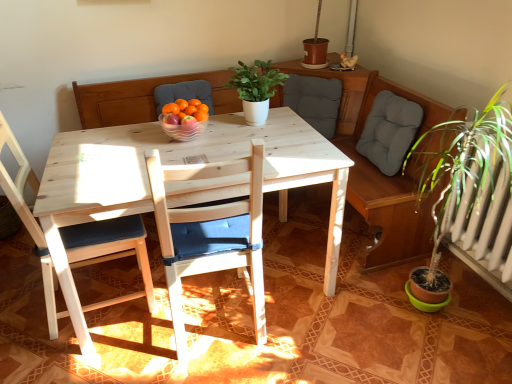
Question: Can you confirm if gray fabric cushion at upper center is wider than wooden chair with blue cushion at left, which is the 1th chair from left to right?

Choices:
 (A) no
 (B) yes

Answer: (A)

Question: Considering the relative sizes of gray fabric cushion at upper center and wooden chair with blue cushion at left, which is the 1th chair from left to right, in the image provided, is gray fabric cushion at upper center taller than wooden chair with blue cushion at left, which is the 1th chair from left to right,?

Choices:
 (A) yes
 (B) no

Answer: (B)

Question: Is wooden chair with blue cushion at left, which is counted as the 2th chair, starting from the right, at the back of gray fabric cushion at upper center?

Choices:
 (A) no
 (B) yes

Answer: (A)

Question: Is gray fabric cushion at upper center far away from wooden chair with blue cushion at left, which is the 1th chair from left to right?

Choices:
 (A) no
 (B) yes

Answer: (B)

Question: Could you tell me if gray fabric cushion at upper center is turned towards wooden chair with blue cushion at left, which is counted as the 2th chair, starting from the right?

Choices:
 (A) no
 (B) yes

Answer: (B)

Question: Is gray fabric cushion at upper center completely or partially outside of wooden chair with blue cushion at left, which is counted as the 2th chair, starting from the right?

Choices:
 (A) yes
 (B) no

Answer: (A)

Question: Can you confirm if wooden chair with blue cushion at center, which is the 1th chair from right to left, is smaller than green matte plant at center?

Choices:
 (A) yes
 (B) no

Answer: (B)

Question: Can you confirm if wooden chair with blue cushion at center, the second chair from the left, is bigger than green matte plant at center?

Choices:
 (A) yes
 (B) no

Answer: (A)

Question: Is wooden chair with blue cushion at center, the second chair from the left, positioned in front of green matte plant at center?

Choices:
 (A) yes
 (B) no

Answer: (A)

Question: Is green matte plant at center inside wooden chair with blue cushion at center, the second chair from the left?

Choices:
 (A) no
 (B) yes

Answer: (A)

Question: Is wooden chair with blue cushion at center, the second chair from the left, oriented away from green matte plant at center?

Choices:
 (A) no
 (B) yes

Answer: (A)

Question: Does wooden chair with blue cushion at center, which is the 1th chair from right to left, have a greater height compared to green matte plant at center?

Choices:
 (A) no
 (B) yes

Answer: (B)

Question: Does clear glass bowl at center contain wooden chair with blue cushion at left, which is counted as the 2th chair, starting from the right?

Choices:
 (A) no
 (B) yes

Answer: (A)